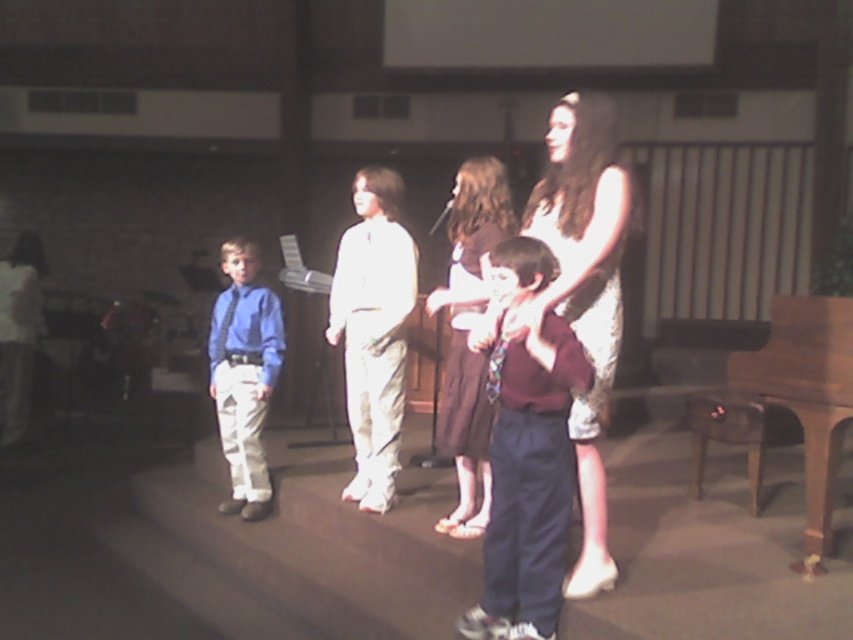
Can you confirm if shiny silver dress at center is wider than matte blue shirt at center?

No, shiny silver dress at center is not wider than matte blue shirt at center.

Describe the element at coordinates (584, 291) in the screenshot. The image size is (853, 640). I see `shiny silver dress at center` at that location.

Who is more distant from viewer, (x=573, y=598) or (x=230, y=355)?

The point (x=230, y=355) is more distant.

I want to click on shiny silver dress at center, so click(x=584, y=291).

Measure the distance between maroon fabric shirt at center and camera.

They are 2.71 meters apart.

Can you confirm if maroon fabric shirt at center is taller than matte blue shirt at center?

Incorrect, maroon fabric shirt at center's height is not larger of matte blue shirt at center's.

At what (x,y) coordinates should I click in order to perform the action: click on maroon fabric shirt at center. Please return your answer as a coordinate pair (x, y). The width and height of the screenshot is (853, 640). Looking at the image, I should click on (527, 456).

The width and height of the screenshot is (853, 640). In order to click on maroon fabric shirt at center in this screenshot , I will do `click(527, 456)`.

Between matte brown dress at center and matte blue shirt at center, which one has more height?

With more height is matte brown dress at center.

Does matte brown dress at center appear over matte blue shirt at center?

Yes.

Where is `matte brown dress at center`? This screenshot has height=640, width=853. matte brown dress at center is located at coordinates (466, 336).